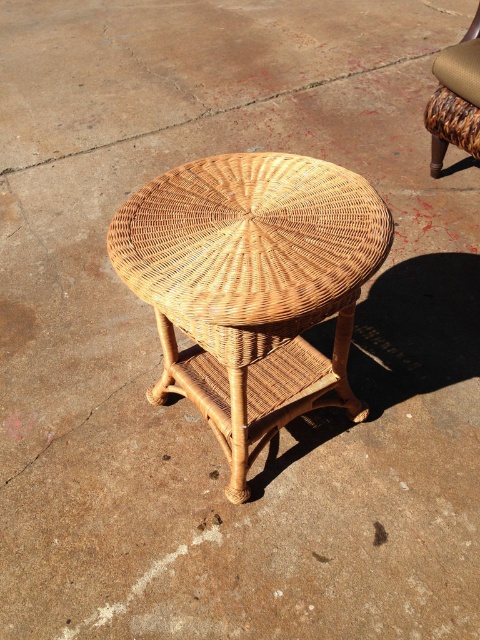
Question: Is the position of natural wicker side table at center more distant than that of woven brown chair at center?

Choices:
 (A) no
 (B) yes

Answer: (A)

Question: Is natural wicker side table at center positioned behind woven brown chair at center?

Choices:
 (A) yes
 (B) no

Answer: (B)

Question: Is natural wicker side table at center to the left of woven brown chair at center from the viewer's perspective?

Choices:
 (A) no
 (B) yes

Answer: (B)

Question: Which of the following is the farthest from the observer?

Choices:
 (A) natural wicker side table at center
 (B) woven brown chair at center

Answer: (B)

Question: Which of the following is the closest to the observer?

Choices:
 (A) woven brown chair at center
 (B) natural wicker side table at center

Answer: (B)